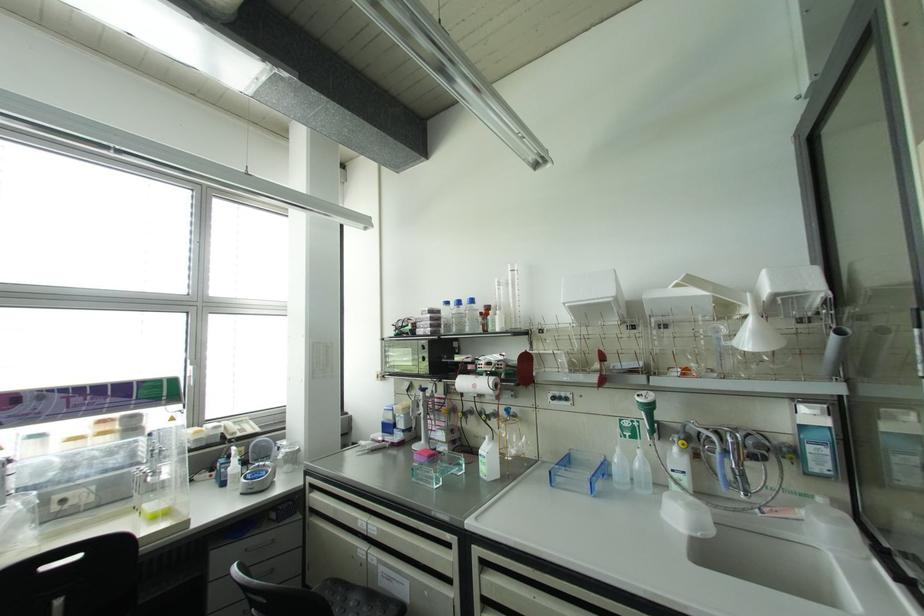
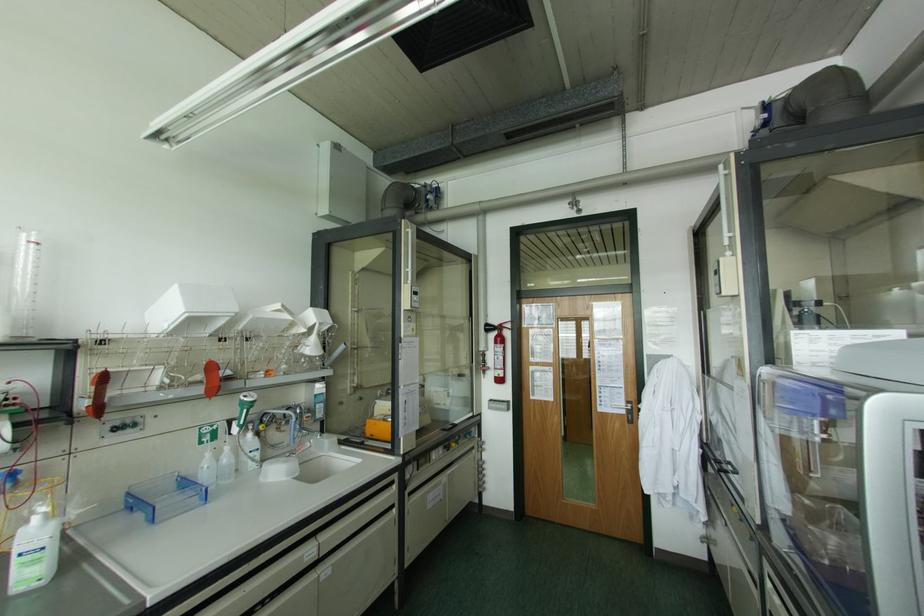
Locate, in the second image, the point that corresponds to [638,451] in the first image.

(226, 448)